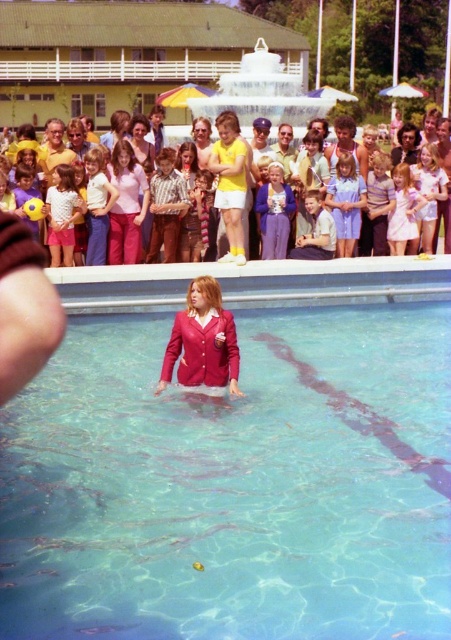
Is clear glass water at center taller than matte yellow shorts at center?

No, clear glass water at center is not taller than matte yellow shorts at center.

Locate an element on the screen. clear glass water at center is located at coordinates (234, 484).

Is clear glass water at center wider than light blue cotton dress at center?

Yes, clear glass water at center is wider than light blue cotton dress at center.

Which is more to the right, clear glass water at center or light blue cotton dress at center?

Positioned to the right is light blue cotton dress at center.

Between point (50, 544) and point (351, 202), which one is positioned behind?

The point (351, 202) is more distant.

Identify the location of clear glass water at center. The height and width of the screenshot is (640, 451). (234, 484).

Who is taller, light blue cotton dress at center or matte yellow shorts at center?

With more height is matte yellow shorts at center.

Is light blue cotton dress at center behind matte yellow shorts at center?

Yes, it is behind matte yellow shorts at center.

Between point (349, 202) and point (351, 132), which one is positioned in front?

Point (349, 202) is in front.

Find the location of a particular element. This screenshot has height=640, width=451. light blue cotton dress at center is located at coordinates coord(345,204).